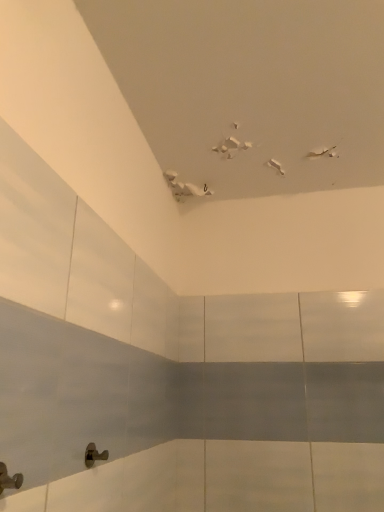
Identify the location of brushed metal faucet at lower left. (9, 479).

Describe the element at coordinates (9, 479) in the screenshot. I see `brushed metal faucet at lower left` at that location.

At what (x,y) coordinates should I click in order to perform the action: click on brushed metal faucet at lower left. Please return your answer as a coordinate pair (x, y). This screenshot has height=512, width=384. Looking at the image, I should click on (9, 479).